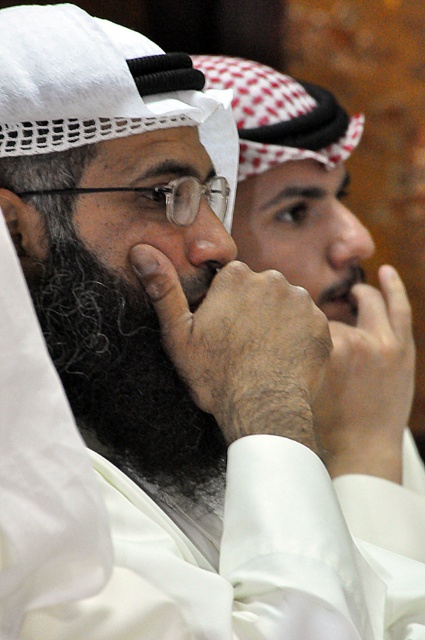
Can you confirm if dry skin/hairy hand at center is bigger than matte white nose at center?

Yes.

How much distance is there between dry skin/hairy hand at center and matte white nose at center?

dry skin/hairy hand at center is 4.64 inches away from matte white nose at center.

Who is more forward, (190, 368) or (206, 246)?

Point (190, 368)

Find the location of `dry skin/hairy hand at center`. dry skin/hairy hand at center is located at coordinates (241, 346).

Does curly dark brown beard at center lie in front of white matte hand at center?

Yes, curly dark brown beard at center is in front of white matte hand at center.

Is point (172, 419) positioned in front of point (357, 416)?

Yes, it is in front of point (357, 416).

The image size is (425, 640). I want to click on curly dark brown beard at center, so click(x=121, y=371).

Looking at this image, which is more to the left, smooth skin nose at center or matte white nose at center?

matte white nose at center

Which is above, smooth skin nose at center or matte white nose at center?

Positioned higher is smooth skin nose at center.

Measure the distance between smooth skin nose at center and camera.

smooth skin nose at center is 1.92 meters away from camera.

The image size is (425, 640). Identify the location of smooth skin nose at center. (345, 237).